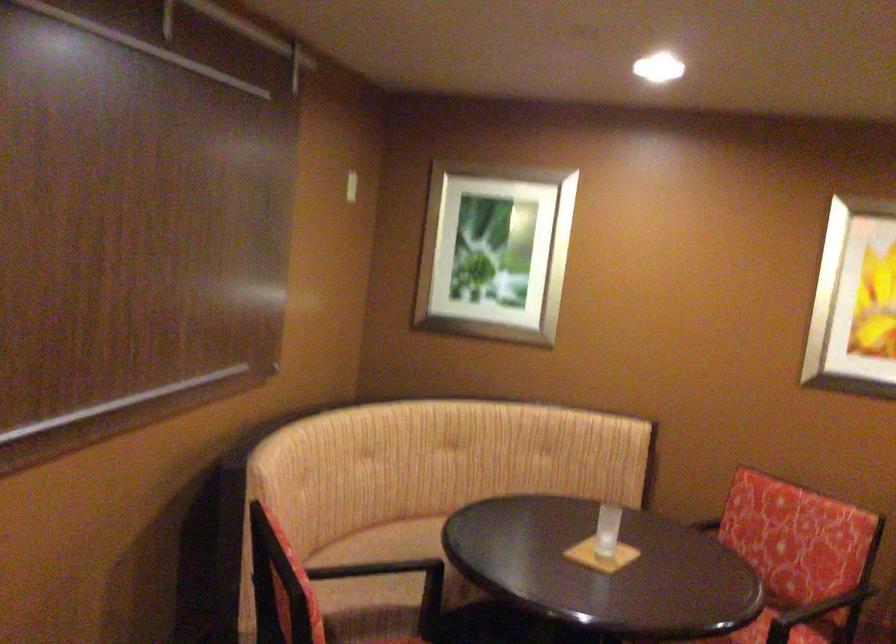
Question: The images are taken continuously from a first-person perspective. In which direction is your viewpoint rotating?

Choices:
 (A) Left
 (B) Right
 (C) Up
 (D) Down

Answer: (B)